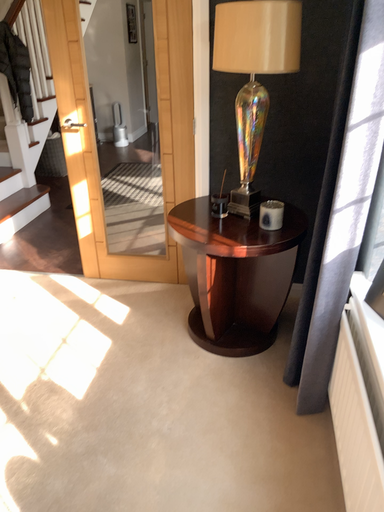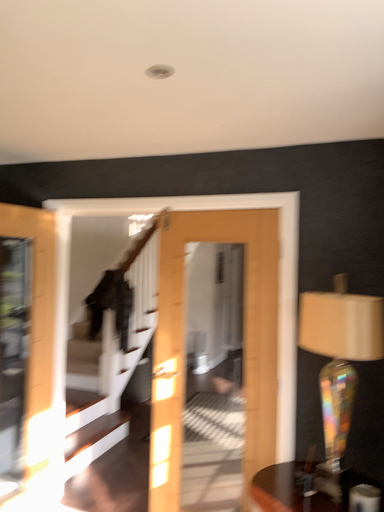
Question: Which way did the camera rotate in the video?

Choices:
 (A) rotated upward
 (B) rotated downward

Answer: (A)